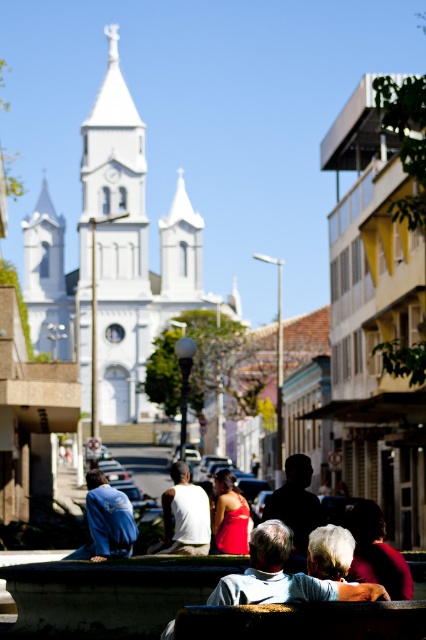
Is dark red fabric at lower right wider than shiny red dress at center?

Indeed, dark red fabric at lower right has a greater width compared to shiny red dress at center.

Between dark red fabric at lower right and shiny red dress at center, which one has less height?

Standing shorter between the two is dark red fabric at lower right.

Find the location of a particular element. dark red fabric at lower right is located at coordinates (376, 552).

Is gray fabric jacket at lower center positioned behind blue denim jacket at lower left?

No, it is not.

Who is more distant from viewer, (265, 547) or (132, 548)?

The point (132, 548) is more distant.

Is point (250, 536) closer to camera compared to point (98, 500)?

Yes, it is in front of point (98, 500).

You are a GUI agent. You are given a task and a screenshot of the screen. Output one action in this format:
    pyautogui.click(x=<x>, y=<y>)
    Task: Click on the gray fabric jacket at lower center
    
    Given the screenshot: What is the action you would take?
    pyautogui.click(x=282, y=577)

How far apart are white smooth church at center and gray fabric jacket at lower center?

white smooth church at center and gray fabric jacket at lower center are 390.41 feet apart from each other.

Between white smooth church at center and gray fabric jacket at lower center, which one is positioned lower?

Positioned lower is gray fabric jacket at lower center.

Who is more forward, (97, 285) or (281, 522)?

Positioned in front is point (281, 522).

At what (x,y) coordinates should I click in order to perform the action: click on white smooth church at center. Please return your answer as a coordinate pair (x, y). Image resolution: width=426 pixels, height=640 pixels. Looking at the image, I should click on (115, 259).